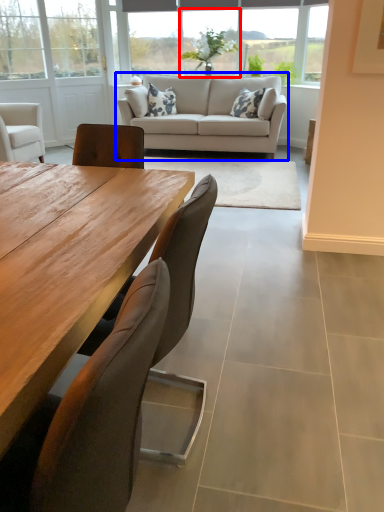
Question: Which object appears farthest to the camera in this image, window (highlighted by a red box) or studio couch (highlighted by a blue box)?

Choices:
 (A) window
 (B) studio couch

Answer: (A)